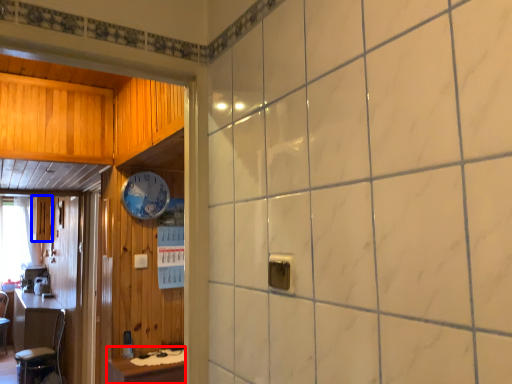
Question: Which object is closer to the camera taking this photo, table (highlighted by a red box) or cabinetry (highlighted by a blue box)?

Choices:
 (A) table
 (B) cabinetry

Answer: (A)